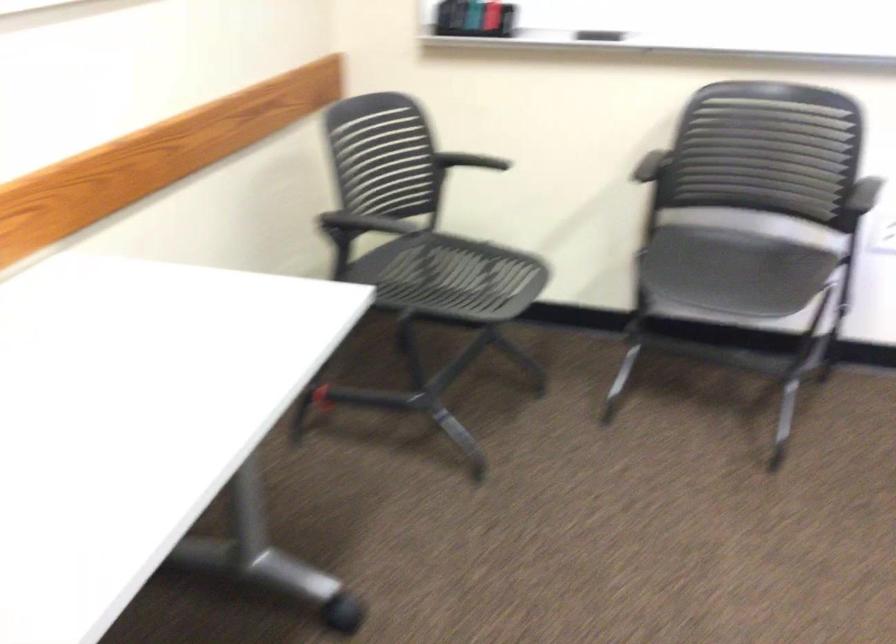
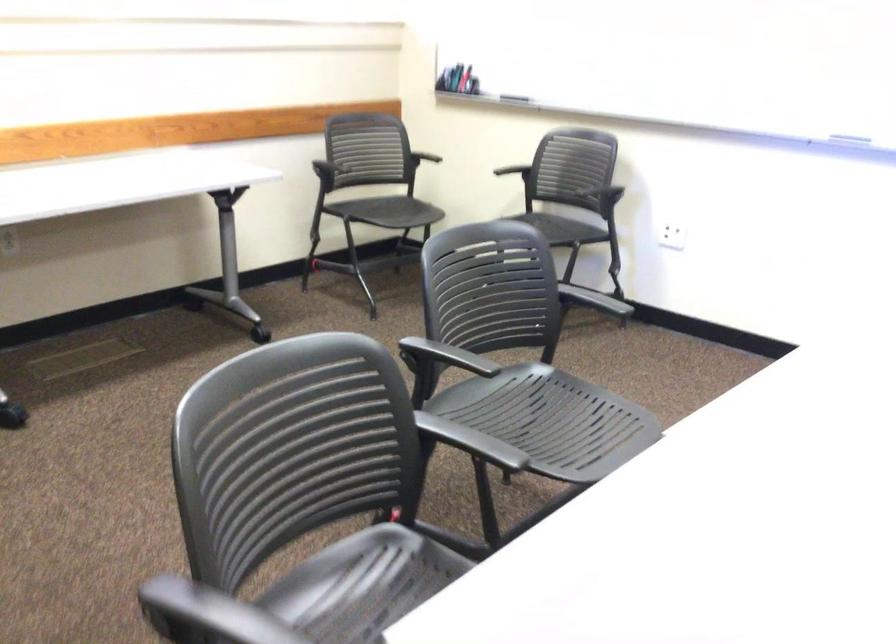
Question: I am providing you with two images of the same scene from different viewpoints. Which of the following objects are not visible in image2?

Choices:
 (A) chair sitting surface
 (B) whiteboard marker
 (C) top book
 (D) black chair armrest

Answer: (A)